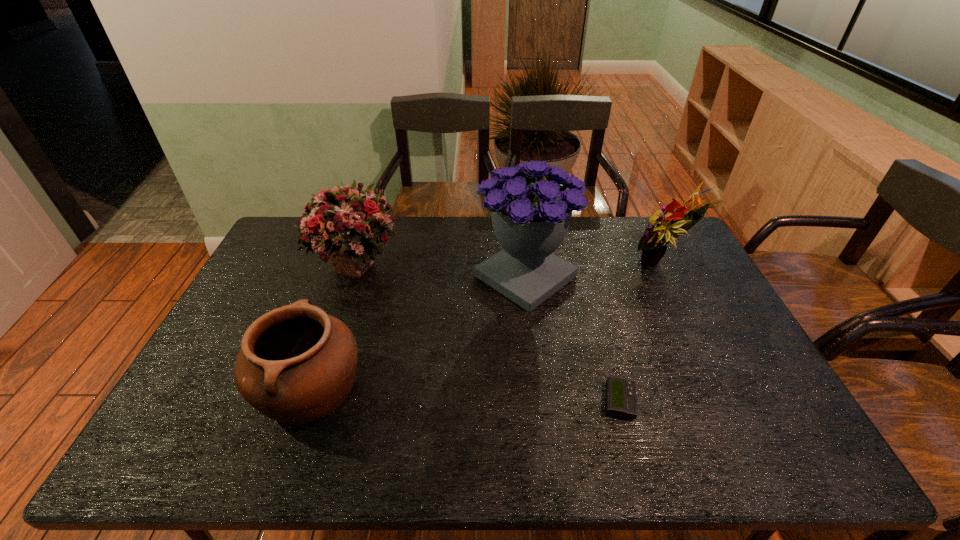
Where is `free space located 0.180m on the right of the leftmost bouquet`? The image size is (960, 540). free space located 0.180m on the right of the leftmost bouquet is located at coordinates (457, 264).

In order to click on free point located 0.210m on the back of the second shortest object in this screenshot , I will do `click(342, 295)`.

Where is `vacant space located 0.110m on the right of the beeper`? The height and width of the screenshot is (540, 960). vacant space located 0.110m on the right of the beeper is located at coordinates 682,402.

In order to click on object located at the near edge in this screenshot , I will do `click(297, 364)`.

Where is `object at the right edge`? object at the right edge is located at coordinates (653, 243).

Locate an element on the screen. object that is positioned at the far right corner is located at coordinates (653, 243).

Where is `free space at the far edge of the desktop`? The width and height of the screenshot is (960, 540). free space at the far edge of the desktop is located at coordinates (573, 252).

The width and height of the screenshot is (960, 540). Identify the location of blank space at the near edge of the desktop. (693, 464).

The width and height of the screenshot is (960, 540). In the image, there is a desktop. In order to click on vacant region at the right edge in this screenshot , I will do `click(699, 342)`.

Identify the location of vacant space at the far right corner of the desktop. This screenshot has height=540, width=960. (680, 254).